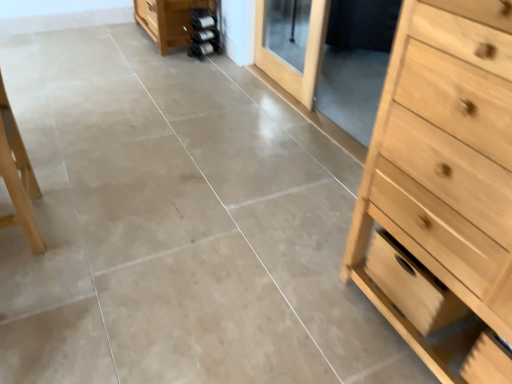
Question: Should I look upward or downward to see light wood drawer at right?

Choices:
 (A) down
 (B) up

Answer: (A)

Question: Is light brown wooden screen door at upper center at the right side of light wood drawer at right?

Choices:
 (A) no
 (B) yes

Answer: (A)

Question: Is light brown wooden screen door at upper center facing away from light wood drawer at right?

Choices:
 (A) yes
 (B) no

Answer: (B)

Question: Considering the relative sizes of light brown wooden screen door at upper center and light wood drawer at right in the image provided, is light brown wooden screen door at upper center thinner than light wood drawer at right?

Choices:
 (A) no
 (B) yes

Answer: (B)

Question: Is light brown wooden screen door at upper center not near light wood drawer at right?

Choices:
 (A) yes
 (B) no

Answer: (A)

Question: From the image's perspective, is light brown wooden screen door at upper center under light wood drawer at right?

Choices:
 (A) yes
 (B) no

Answer: (B)

Question: Is light brown wooden screen door at upper center to the left of light wood drawer at right from the viewer's perspective?

Choices:
 (A) yes
 (B) no

Answer: (A)

Question: Is light wood chest of drawers at right smaller than light brown wooden screen door at upper center?

Choices:
 (A) no
 (B) yes

Answer: (A)

Question: Is light wood chest of drawers at right positioned before light brown wooden screen door at upper center?

Choices:
 (A) no
 (B) yes

Answer: (B)

Question: Does light wood chest of drawers at right have a lesser height compared to light brown wooden screen door at upper center?

Choices:
 (A) yes
 (B) no

Answer: (B)

Question: Can you confirm if light wood chest of drawers at right is taller than light brown wooden screen door at upper center?

Choices:
 (A) yes
 (B) no

Answer: (A)

Question: Is light wood chest of drawers at right at the right side of light brown wooden screen door at upper center?

Choices:
 (A) no
 (B) yes

Answer: (B)

Question: Is light wood chest of drawers at right not within light brown wooden screen door at upper center?

Choices:
 (A) yes
 (B) no

Answer: (A)

Question: Is light wood drawer at right aimed at light brown wooden screen door at upper center?

Choices:
 (A) yes
 (B) no

Answer: (B)